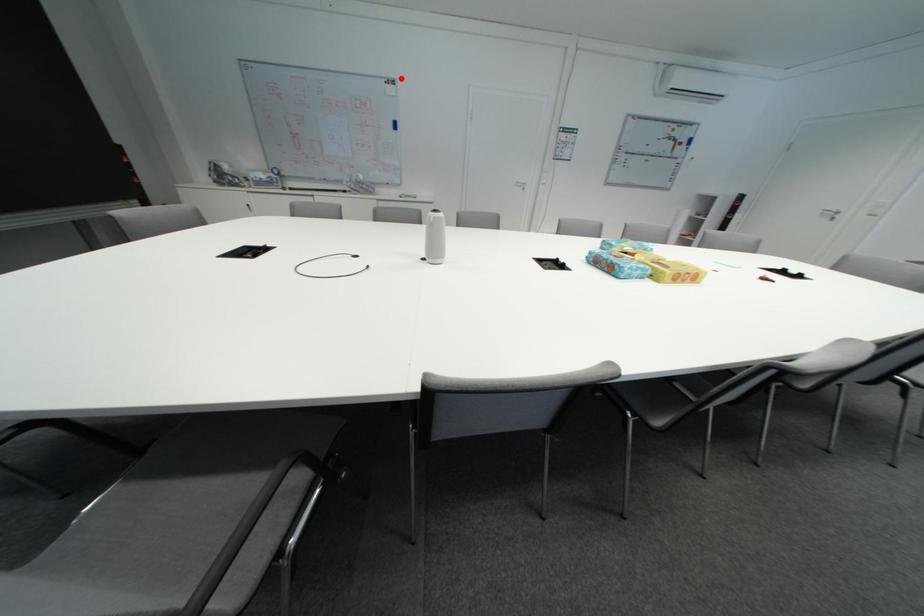
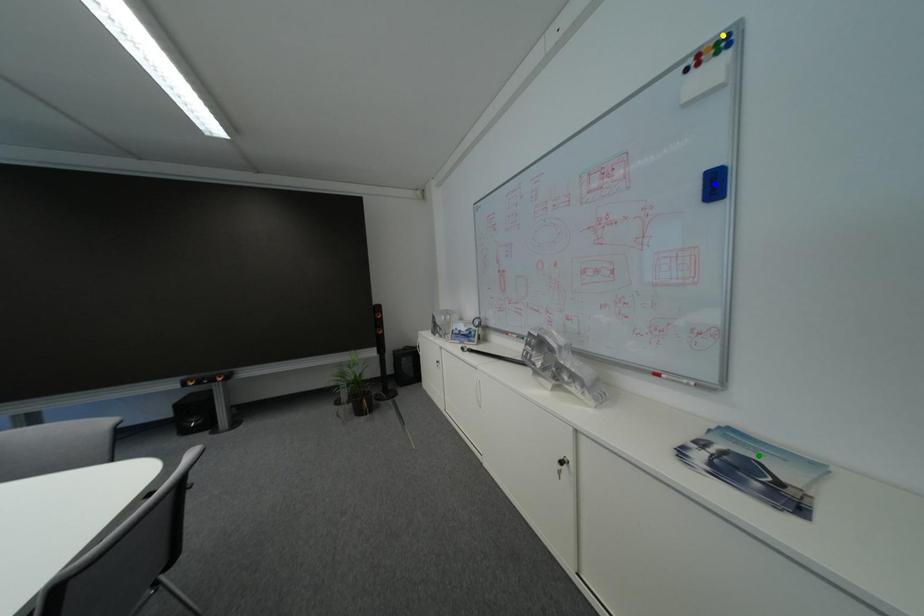
Question: I am providing you with two images of the same scene from different viewpoints. A red point is marked on the first image. You are given multiple points on the second image. In image 2, which mark is for the same physical point as the one in image 1?

Choices:
 (A) yellow point
 (B) blue point
 (C) green point

Answer: (A)